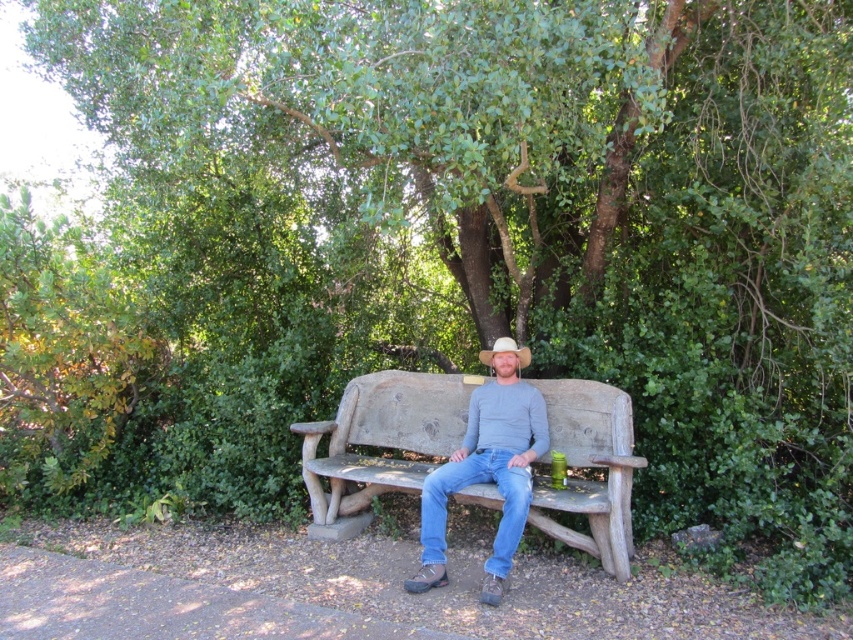
Is rustic wood bench at center smaller than white matte cowboy hat at center?

Actually, rustic wood bench at center might be larger than white matte cowboy hat at center.

Is point (561, 396) in front of point (519, 348)?

Yes, it is.

Locate an element on the screen. The height and width of the screenshot is (640, 853). rustic wood bench at center is located at coordinates (381, 436).

Is point (494, 396) farther from viewer compared to point (490, 352)?

No, (494, 396) is closer to viewer.

Find the location of `matte gray shirt at center`. matte gray shirt at center is located at coordinates (486, 474).

Which is below, rustic wood bench at center or matte gray shirt at center?

matte gray shirt at center

Between point (413, 476) and point (509, 372), which one is positioned in front?

Point (413, 476)

Identify the location of rustic wood bench at center. (381, 436).